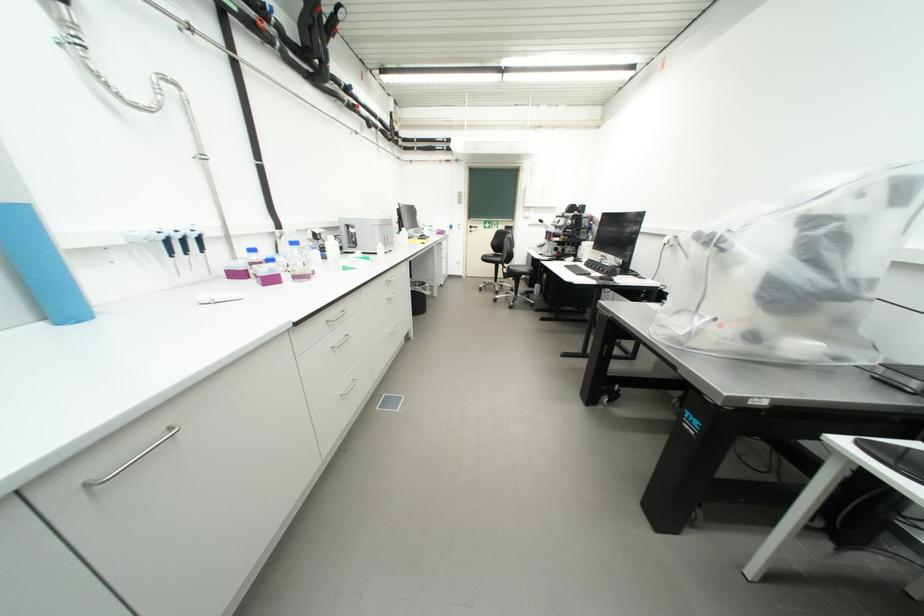
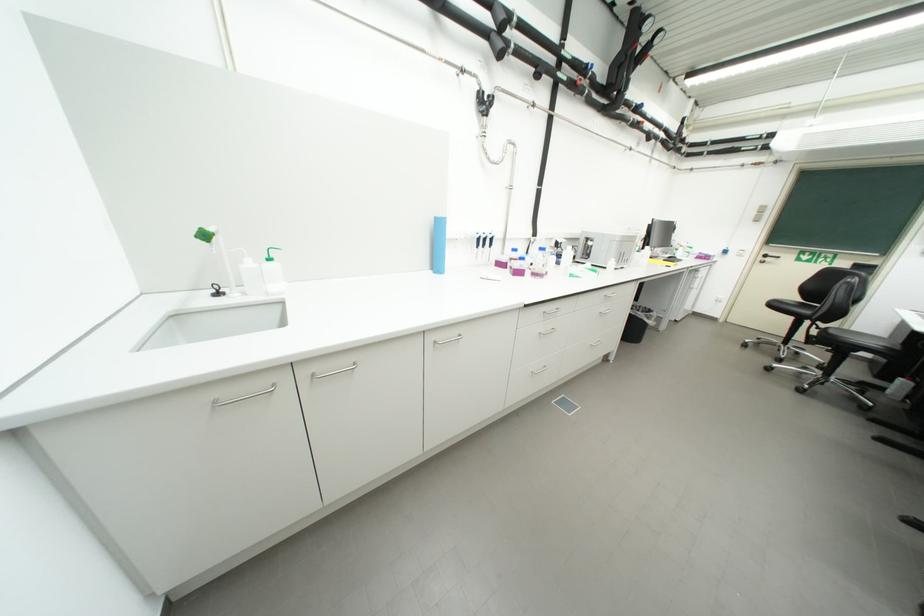
Find the pixel in the second image that matches pixel 427 291 in the first image.

(649, 317)